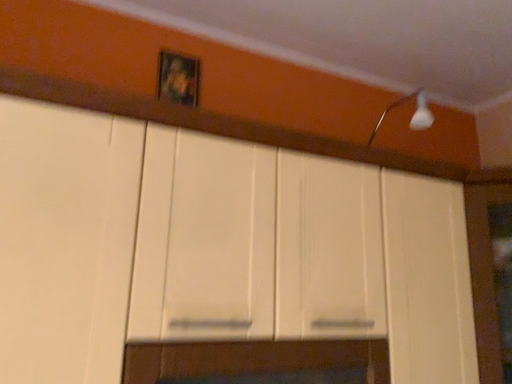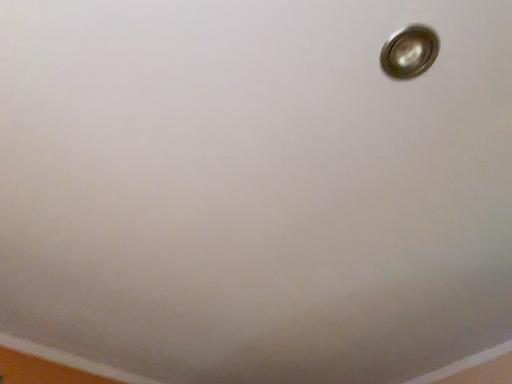
Question: Which way did the camera rotate in the video?

Choices:
 (A) rotated upward
 (B) rotated downward

Answer: (A)